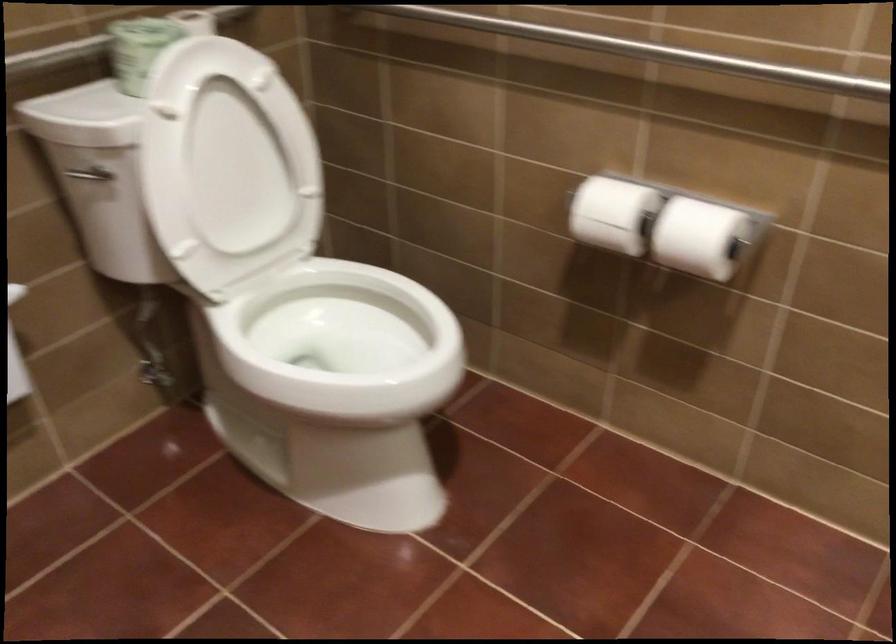
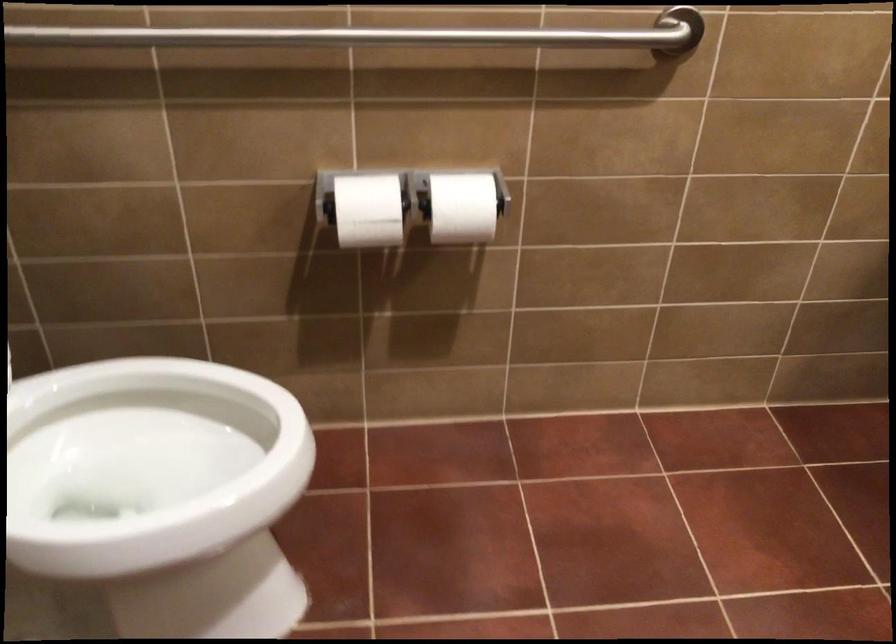
Find the pixel in the second image that matches [688,232] in the first image.

(462, 207)